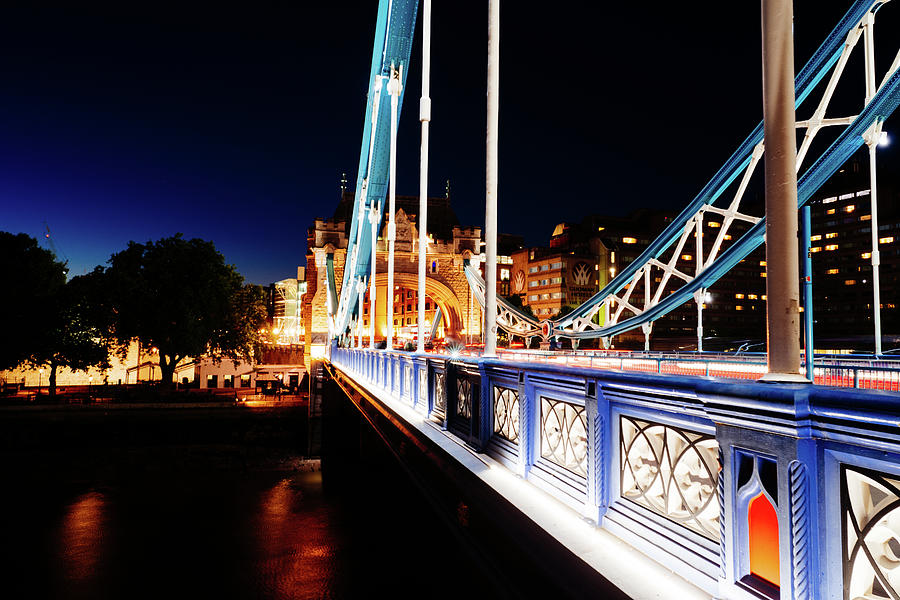
The height and width of the screenshot is (600, 900). In order to click on reflection of lights in this screenshot , I will do (87, 521).